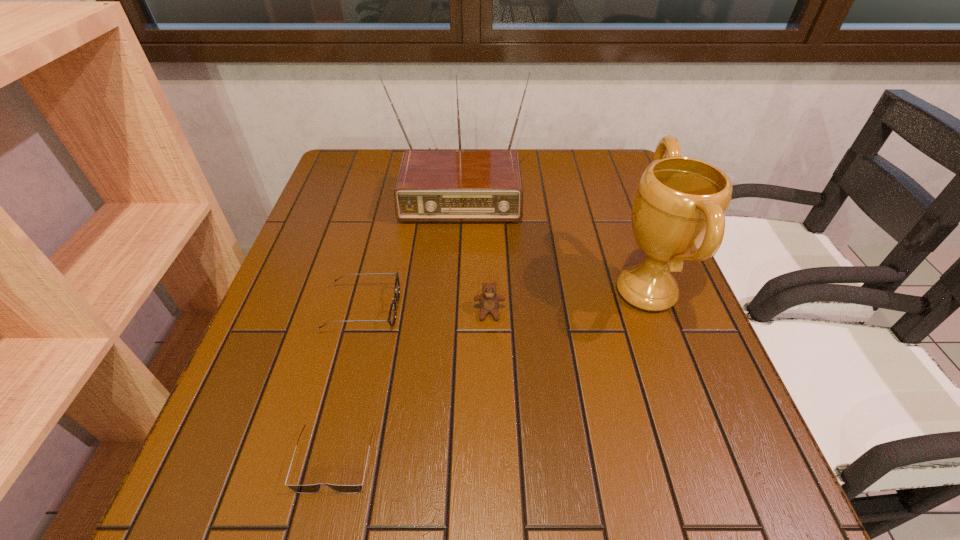
This screenshot has height=540, width=960. Find the location of `free space located at the face of the teddy bear`. free space located at the face of the teddy bear is located at coordinates (492, 436).

Locate an element on the screen. Image resolution: width=960 pixels, height=540 pixels. vacant space located through the lenses of the spectacles is located at coordinates (542, 309).

Image resolution: width=960 pixels, height=540 pixels. I want to click on object that is at the far edge, so click(436, 185).

The width and height of the screenshot is (960, 540). I want to click on object that is at the near edge, so click(307, 489).

At what (x,y) coordinates should I click in order to perform the action: click on spectacles at the left edge. Please return your answer as a coordinate pair (x, y). The image size is (960, 540). Looking at the image, I should click on (392, 313).

Identify the location of sunglasses positioned at the left edge. This screenshot has width=960, height=540. (307, 489).

What are the coordinates of `object located in the right edge section of the desktop` in the screenshot? It's located at (678, 213).

Find the location of a particular element. object that is at the near left corner is located at coordinates (307, 489).

Identify the location of vacant area at the near edge. (660, 533).

In the image, there is a desktop. Where is `vacant region at the left edge`? vacant region at the left edge is located at coordinates (270, 388).